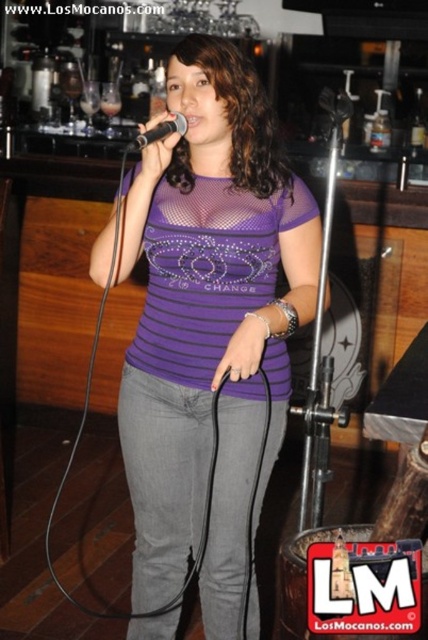
Is purple mesh shirt at center in front of black matte microphone at center?

No.

Describe the element at coordinates (208, 323) in the screenshot. I see `purple mesh shirt at center` at that location.

Locate an element on the screen. Image resolution: width=428 pixels, height=640 pixels. purple mesh shirt at center is located at coordinates (208, 323).